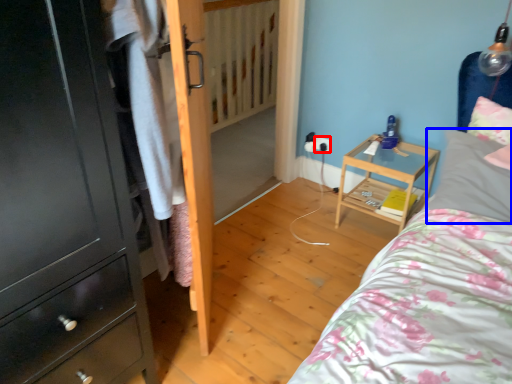
Question: Which of the following is the closest to the observer, electric outlet (highlighted by a red box) or pillow (highlighted by a blue box)?

Choices:
 (A) electric outlet
 (B) pillow

Answer: (B)